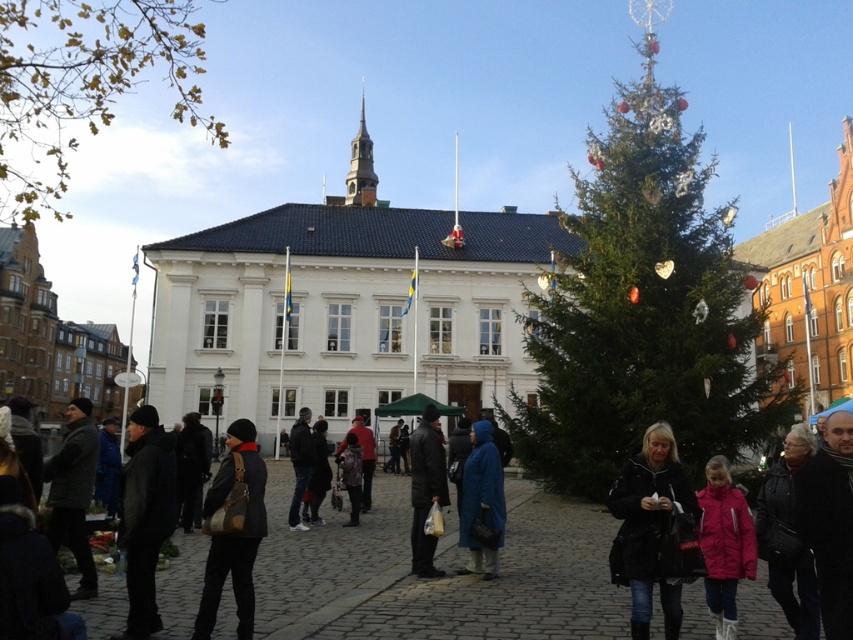
You are standing in the town square and want to take a photo of the two points marked in the scene. Which point, point (x=674, y=474) or point (x=495, y=532), will appear larger in your camera view?

Point (x=674, y=474) is closer to the viewer than point (x=495, y=532), so it will appear larger in the camera view.

You are a tailor measuring garments in a busy town square. You have two items to assess for alterations. The first is the black leather jacket at center, and the second is the blue matte coat at center. Which garment has a greater width?

The black leather jacket at center has a greater width than the blue matte coat at center.

You are a delivery person who needs to place a package exactly at the coordinates specified in the image. The package must be placed where the black leather jacket at center is located. According to the coordinates given, where should you place the package?

The package should be placed at the coordinates point [648,528] where the black leather jacket at center is located.